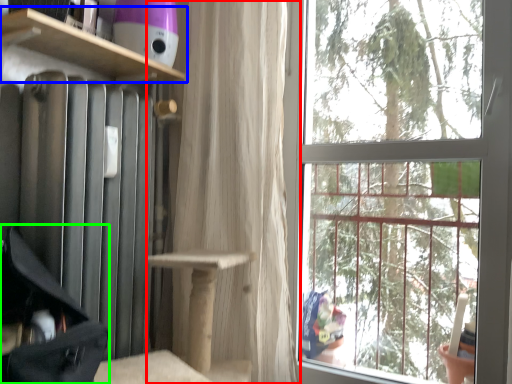
Question: Considering the real-world distances, which object is farthest from curtain (highlighted by a red box)? shelf (highlighted by a blue box) or luggage (highlighted by a green box)?

Choices:
 (A) shelf
 (B) luggage

Answer: (B)